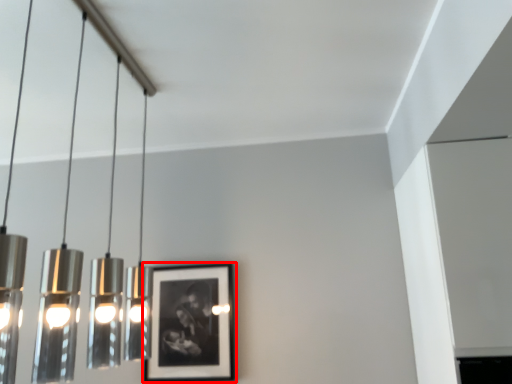
Question: Where is picture frame (annotated by the red box) located in relation to lamp in the image?

Choices:
 (A) right
 (B) left

Answer: (A)